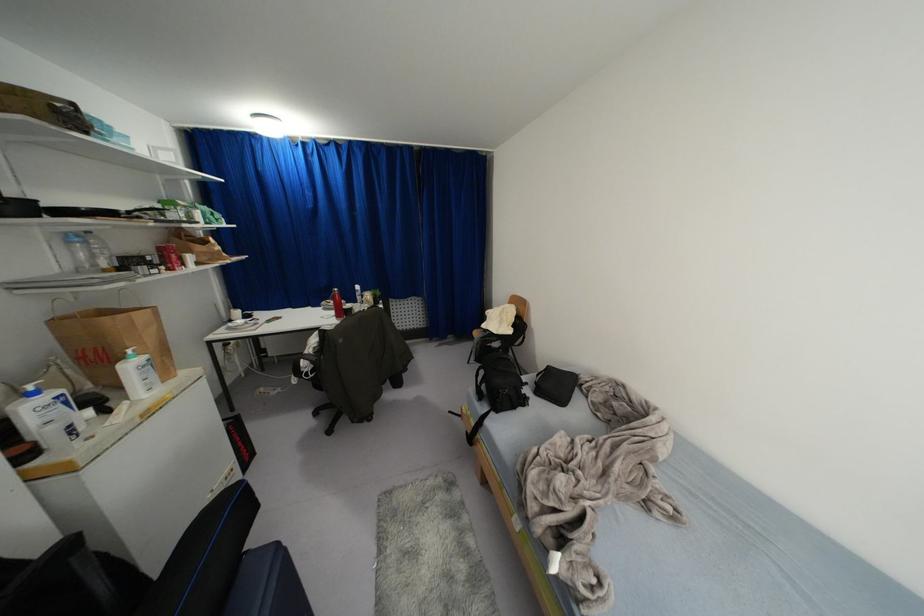
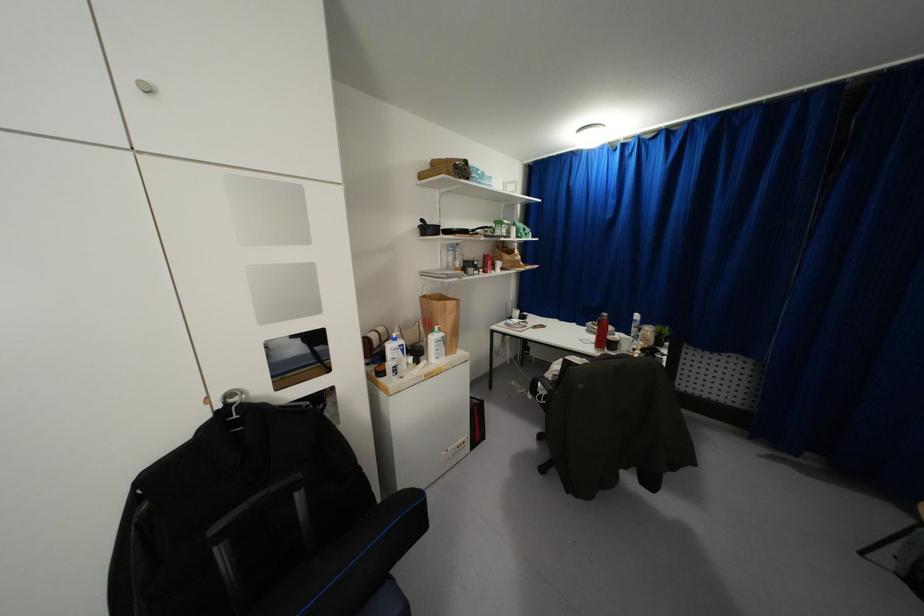
Question: The camera is either moving clockwise (left) or counter-clockwise (right) around the object. The first image is from the beginning of the video and the second image is from the end. Is the camera moving left or right when shooting the video?

Choices:
 (A) Left
 (B) Right

Answer: (B)